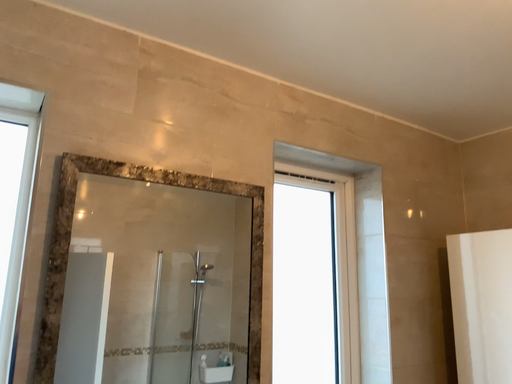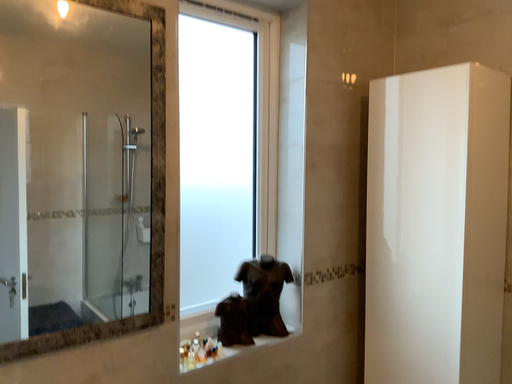
Question: How did the camera likely rotate when shooting the video?

Choices:
 (A) rotated downward
 (B) rotated upward

Answer: (A)